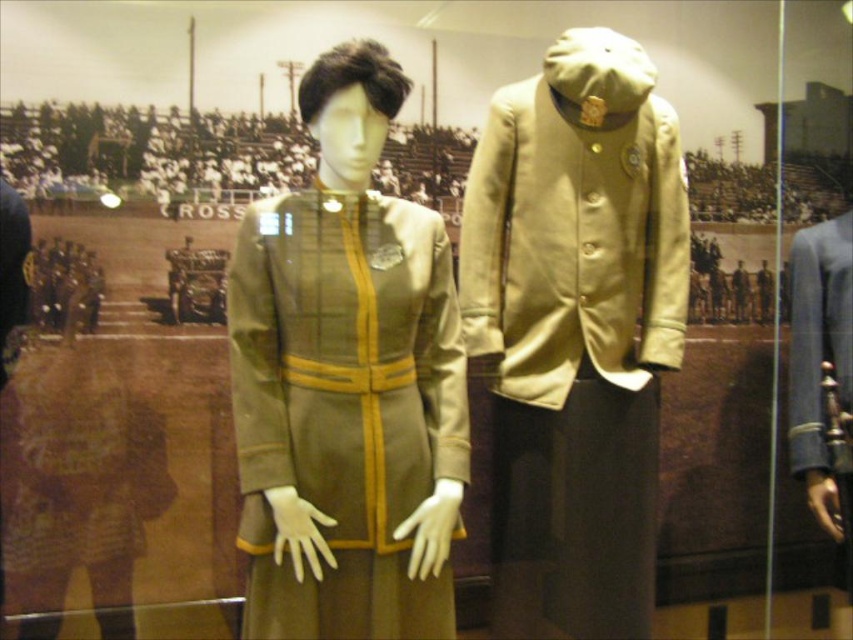
Question: Which point is farther to the camera?

Choices:
 (A) matte green fabric dress at center
 (B) light olive-green fabric jacket at center

Answer: (B)

Question: Is matte green fabric dress at center to the left of light olive-green fabric jacket at center from the viewer's perspective?

Choices:
 (A) yes
 (B) no

Answer: (A)

Question: Is matte green fabric dress at center to the left of light olive-green fabric jacket at center from the viewer's perspective?

Choices:
 (A) no
 (B) yes

Answer: (B)

Question: Which of the following is the closest to the observer?

Choices:
 (A) (663, 316)
 (B) (428, 371)

Answer: (B)

Question: Does matte green fabric dress at center appear on the left side of light olive-green fabric jacket at center?

Choices:
 (A) yes
 (B) no

Answer: (A)